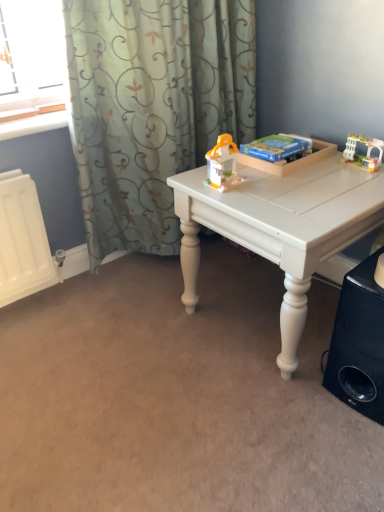
In order to face satin green curtain at upper left, should I rotate leftwards or rightwards?

Rotate left and turn 4.314 degrees.

This screenshot has width=384, height=512. What do you see at coordinates (359, 343) in the screenshot?
I see `black matte speaker at lower right` at bounding box center [359, 343].

Find the location of a particular element. The image size is (384, 512). white matte table at center is located at coordinates (280, 227).

The height and width of the screenshot is (512, 384). In order to click on satin green curtain at upper left in this screenshot , I will do `click(152, 106)`.

Are white plastic toy at upper right, the first toy when ordered from right to left, and white matte table at center located far from each other?

No.

Is white plastic toy at upper right, the first toy when ordered from right to left, behind white matte table at center?

Yes.

From the image's perspective, is white plastic toy at upper right, marked as the 2th toy in a left-to-right arrangement, beneath white matte table at center?

No, from the image's perspective, white plastic toy at upper right, marked as the 2th toy in a left-to-right arrangement, is not beneath white matte table at center.

Is white plastic toy at upper right, marked as the 2th toy in a left-to-right arrangement, located outside white matte table at center?

Yes.

Which object is positioned more to the left, satin green curtain at upper left or white matte table at center?

satin green curtain at upper left.

Between satin green curtain at upper left and white matte table at center, which one has less height?

Standing shorter between the two is white matte table at center.

Can you see satin green curtain at upper left touching white matte table at center?

They are not placed beside each other.

Is satin green curtain at upper left outside of white matte table at center?

satin green curtain at upper left lies outside white matte table at center's area.

From a real-world perspective, relative to white plastic toy at upper right, marked as the 2th toy in a left-to-right arrangement, is white matte table at center vertically above or below?

white matte table at center is situated lower than white plastic toy at upper right, marked as the 2th toy in a left-to-right arrangement, in the real world.

Would you say white plastic toy at upper right, marked as the 2th toy in a left-to-right arrangement, is part of white matte table at center's contents?

Actually, white plastic toy at upper right, marked as the 2th toy in a left-to-right arrangement, is outside white matte table at center.

Is point (214, 154) more distant than point (299, 246)?

Yes.

Which of these two, translucent plastic toy at center, which ranks as the second toy in right-to-left order, or white matte table at center, is thinner?

With smaller width is translucent plastic toy at center, which ranks as the second toy in right-to-left order.

Considering the relative positions of translucent plastic toy at center, which ranks as the second toy in right-to-left order, and white matte table at center in the image provided, is translucent plastic toy at center, which ranks as the second toy in right-to-left order, to the left of white matte table at center from the viewer's perspective?

Yes, translucent plastic toy at center, which ranks as the second toy in right-to-left order, is to the left of white matte table at center.

Considering the sizes of translucent plastic toy at center, which ranks as the second toy in right-to-left order, and white matte table at center in the image, is translucent plastic toy at center, which ranks as the second toy in right-to-left order, taller or shorter than white matte table at center?

Clearly, translucent plastic toy at center, which ranks as the second toy in right-to-left order, is shorter compared to white matte table at center.

Considering the sizes of objects satin green curtain at upper left and translucent plastic toy at center, which ranks as the first toy in left-to-right order, in the image provided, who is thinner, satin green curtain at upper left or translucent plastic toy at center, which ranks as the first toy in left-to-right order,?

translucent plastic toy at center, which ranks as the first toy in left-to-right order, is thinner.

From a real-world perspective, between satin green curtain at upper left and translucent plastic toy at center, which ranks as the second toy in right-to-left order, who is vertically lower?

satin green curtain at upper left.

From their relative heights in the image, would you say satin green curtain at upper left is taller or shorter than translucent plastic toy at center, which ranks as the first toy in left-to-right order?

Clearly, satin green curtain at upper left is taller compared to translucent plastic toy at center, which ranks as the first toy in left-to-right order.

Between satin green curtain at upper left and translucent plastic toy at center, which ranks as the second toy in right-to-left order, which one has smaller size?

translucent plastic toy at center, which ranks as the second toy in right-to-left order, is smaller.

How far apart are white matte table at center and translucent plastic toy at center, which ranks as the second toy in right-to-left order?

20.75 centimeters.

Consider the image. Does white matte table at center have a lesser width compared to translucent plastic toy at center, which ranks as the first toy in left-to-right order?

No, white matte table at center is not thinner than translucent plastic toy at center, which ranks as the first toy in left-to-right order.

Considering the sizes of white matte table at center and translucent plastic toy at center, which ranks as the first toy in left-to-right order, in the image, is white matte table at center taller or shorter than translucent plastic toy at center, which ranks as the first toy in left-to-right order,?

Clearly, white matte table at center is taller compared to translucent plastic toy at center, which ranks as the first toy in left-to-right order.

Relative to translucent plastic toy at center, which ranks as the second toy in right-to-left order, is white matte table at center in front or behind?

In the image, white matte table at center appears in front of translucent plastic toy at center, which ranks as the second toy in right-to-left order.

Is white matte table at center turned away from satin green curtain at upper left?

No, satin green curtain at upper left is not at the back of white matte table at center.

Is white matte table at center smaller than satin green curtain at upper left?

Indeed, white matte table at center has a smaller size compared to satin green curtain at upper left.

Would you say white matte table at center is to the left or to the right of satin green curtain at upper left in the picture?

Clearly, white matte table at center is on the right of satin green curtain at upper left in the image.

How many degrees apart are the facing directions of white matte table at center and satin green curtain at upper left?

white matte table at center and satin green curtain at upper left are facing 89.9 degrees away from each other.

Locate an element on the screen. table to the left of white plastic toy at upper right, marked as the 2th toy in a left-to-right arrangement is located at coordinates (280, 227).

Locate an element on the screen. This screenshot has width=384, height=512. curtain above the white matte table at center (from a real-world perspective) is located at coordinates (152, 106).

Based on their spatial positions, is white plastic toy at upper right, marked as the 2th toy in a left-to-right arrangement, or satin green curtain at upper left further from translucent plastic toy at center, which ranks as the second toy in right-to-left order?

satin green curtain at upper left is further to translucent plastic toy at center, which ranks as the second toy in right-to-left order.

Based on their spatial positions, is white matte table at center or satin green curtain at upper left closer to black matte speaker at lower right?

white matte table at center is positioned closer to the anchor black matte speaker at lower right.

Considering their positions, is white plastic toy at upper right, marked as the 2th toy in a left-to-right arrangement, positioned closer to white matte table at center than translucent plastic toy at center, which ranks as the second toy in right-to-left order?

Based on the image, translucent plastic toy at center, which ranks as the second toy in right-to-left order, appears to be nearer to white matte table at center.

From the image, which object appears to be nearer to black matte speaker at lower right, white plastic toy at upper right, the first toy when ordered from right to left, or white matte table at center?

white matte table at center is positioned closer to the anchor black matte speaker at lower right.

From the image, which object appears to be nearer to satin green curtain at upper left, black matte speaker at lower right or translucent plastic toy at center, which ranks as the second toy in right-to-left order?

translucent plastic toy at center, which ranks as the second toy in right-to-left order.

When comparing their distances from satin green curtain at upper left, does translucent plastic toy at center, which ranks as the first toy in left-to-right order, or white matte table at center seem further?

Based on the image, white matte table at center appears to be further to satin green curtain at upper left.

Which object lies nearer to the anchor point translucent plastic toy at center, which ranks as the second toy in right-to-left order, black matte speaker at lower right or white matte table at center?

Among the two, white matte table at center is located nearer to translucent plastic toy at center, which ranks as the second toy in right-to-left order.

Estimate the real-world distances between objects in this image. Which object is further from black matte speaker at lower right, satin green curtain at upper left or translucent plastic toy at center, which ranks as the second toy in right-to-left order?

satin green curtain at upper left lies further to black matte speaker at lower right than the other object.

This screenshot has height=512, width=384. I want to click on toy between white plastic toy at upper right, marked as the 2th toy in a left-to-right arrangement, and black matte speaker at lower right in the up-down direction, so (x=223, y=164).

You are a GUI agent. You are given a task and a screenshot of the screen. Output one action in this format:
    pyautogui.click(x=<x>, y=<y>)
    Task: Click on the toy between satin green curtain at upper left and white plastic toy at upper right, the first toy when ordered from right to left, from left to right
    This screenshot has width=384, height=512.
    Given the screenshot: What is the action you would take?
    pyautogui.click(x=223, y=164)

Where is `table situated between translucent plastic toy at center, which ranks as the second toy in right-to-left order, and white plastic toy at upper right, the first toy when ordered from right to left, from left to right`? Image resolution: width=384 pixels, height=512 pixels. table situated between translucent plastic toy at center, which ranks as the second toy in right-to-left order, and white plastic toy at upper right, the first toy when ordered from right to left, from left to right is located at coordinates (280, 227).

Locate an element on the screen. This screenshot has width=384, height=512. table between white plastic toy at upper right, marked as the 2th toy in a left-to-right arrangement, and black matte speaker at lower right in the up-down direction is located at coordinates (280, 227).